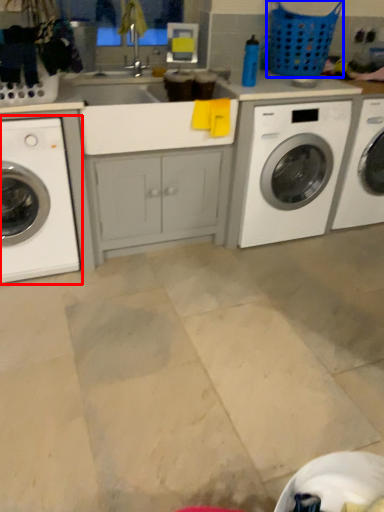
Question: Which of the following is the farthest to the observer, washing machine (highlighted by a red box) or basket (highlighted by a blue box)?

Choices:
 (A) washing machine
 (B) basket

Answer: (B)